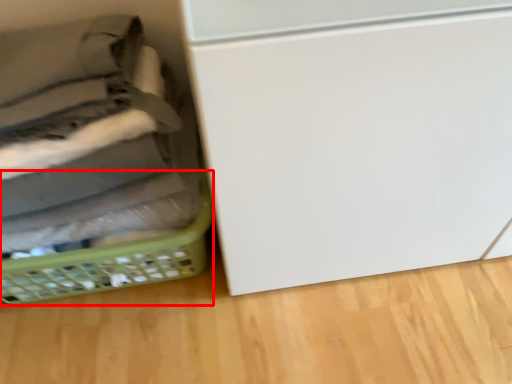
Question: From the image, what is the correct spatial relationship of basket (annotated by the red box) in relation to basket?

Choices:
 (A) left
 (B) right

Answer: (A)